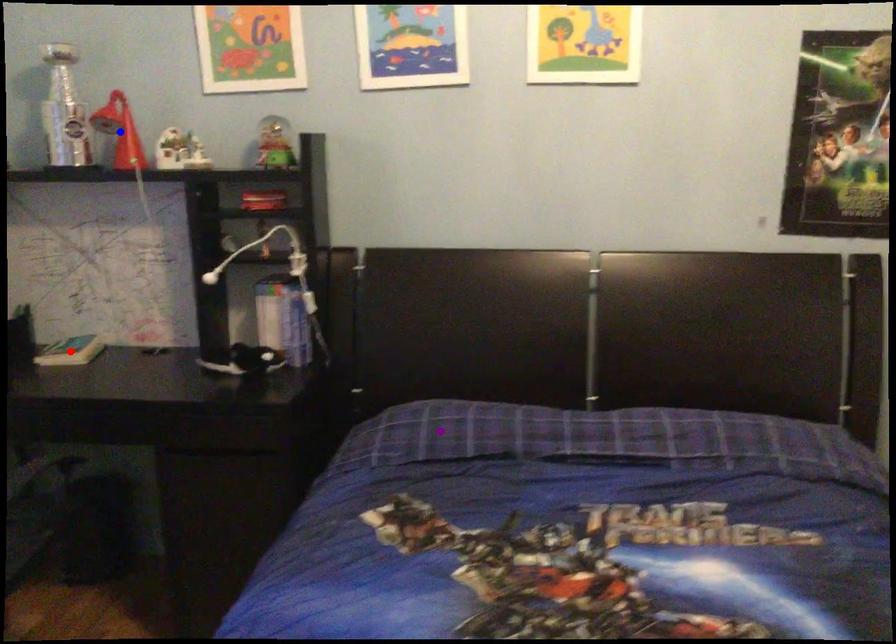
Order these from nearest to farthest:
blue point
red point
purple point

purple point, blue point, red point